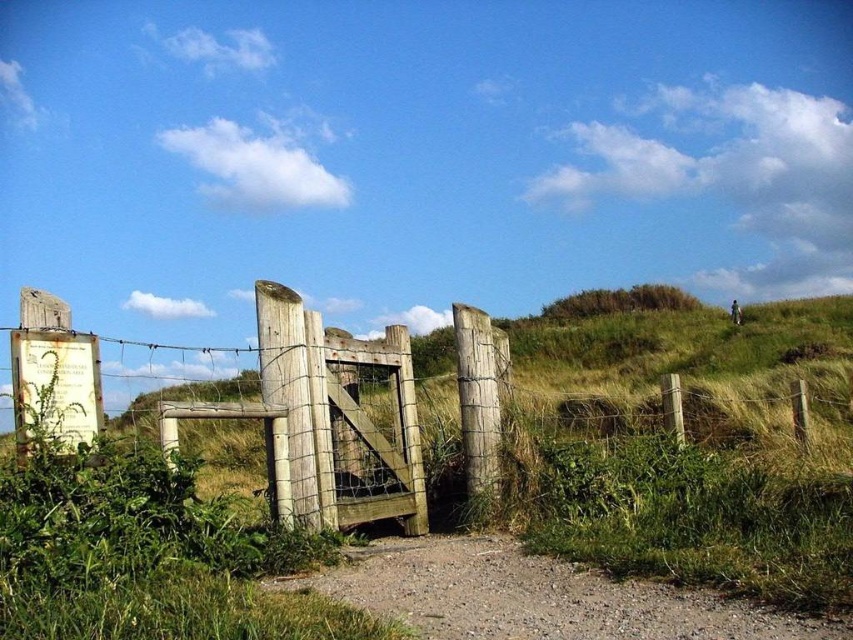
Can you confirm if weathered wood gate at center is shorter than dirt/gravel path at center?

In fact, weathered wood gate at center may be taller than dirt/gravel path at center.

Who is more forward, (56, 394) or (465, 600)?

Positioned in front is point (465, 600).

Locate an element on the screen. weathered wood gate at center is located at coordinates (318, 417).